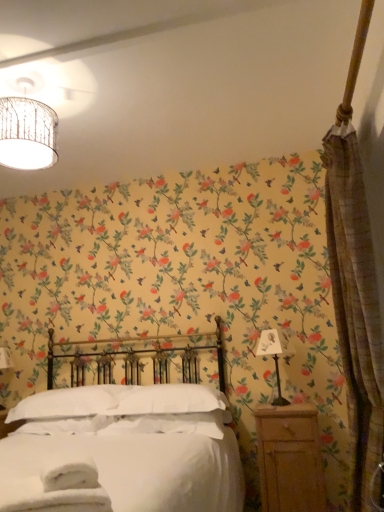
Question: Is white soft pillow at center, positioned as the 1th pillow in left-to-right order, positioned in front of matte woven lampshade at upper left?

Choices:
 (A) no
 (B) yes

Answer: (A)

Question: Is white soft pillow at center, the second pillow from the right, not within matte woven lampshade at upper left?

Choices:
 (A) no
 (B) yes

Answer: (B)

Question: Considering the relative sizes of white soft pillow at center, positioned as the 1th pillow in left-to-right order, and matte woven lampshade at upper left in the image provided, is white soft pillow at center, positioned as the 1th pillow in left-to-right order, shorter than matte woven lampshade at upper left?

Choices:
 (A) yes
 (B) no

Answer: (A)

Question: Considering the relative sizes of white soft pillow at center, the second pillow from the right, and matte woven lampshade at upper left in the image provided, is white soft pillow at center, the second pillow from the right, wider than matte woven lampshade at upper left?

Choices:
 (A) yes
 (B) no

Answer: (A)

Question: Is white soft pillow at center, positioned as the 1th pillow in left-to-right order, not close to matte woven lampshade at upper left?

Choices:
 (A) yes
 (B) no

Answer: (A)

Question: Does point (180, 388) appear closer or farther from the camera than point (340, 238)?

Choices:
 (A) closer
 (B) farther

Answer: (B)

Question: From the image's perspective, relative to textured beige curtain at right, is white soft pillow at center, which is counted as the 2th pillow, starting from the left, above or below?

Choices:
 (A) above
 (B) below

Answer: (B)

Question: In terms of height, does white soft pillow at center, which is counted as the 2th pillow, starting from the left, look taller or shorter compared to textured beige curtain at right?

Choices:
 (A) tall
 (B) short

Answer: (B)

Question: In terms of width, does white soft pillow at center, the first pillow when ordered from right to left, look wider or thinner when compared to textured beige curtain at right?

Choices:
 (A) thin
 (B) wide

Answer: (B)

Question: Is white soft pillow at center, the first pillow when ordered from right to left, taller or shorter than matte woven lampshade at upper left?

Choices:
 (A) short
 (B) tall

Answer: (A)

Question: Looking at the image, does white soft pillow at center, the first pillow when ordered from right to left, seem bigger or smaller compared to matte woven lampshade at upper left?

Choices:
 (A) small
 (B) big

Answer: (B)

Question: Would you say white soft pillow at center, which is counted as the 2th pillow, starting from the left, is inside or outside matte woven lampshade at upper left?

Choices:
 (A) outside
 (B) inside

Answer: (A)

Question: From a real-world perspective, is white soft pillow at center, the first pillow when ordered from right to left, positioned above or below matte woven lampshade at upper left?

Choices:
 (A) above
 (B) below

Answer: (B)

Question: Is white soft pillow at center, which is counted as the 2th pillow, starting from the left, bigger or smaller than metallic silver lamp at right?

Choices:
 (A) big
 (B) small

Answer: (A)

Question: Considering the relative positions of white soft pillow at center, the first pillow when ordered from right to left, and metallic silver lamp at right in the image provided, is white soft pillow at center, the first pillow when ordered from right to left, to the left or to the right of metallic silver lamp at right?

Choices:
 (A) left
 (B) right

Answer: (A)